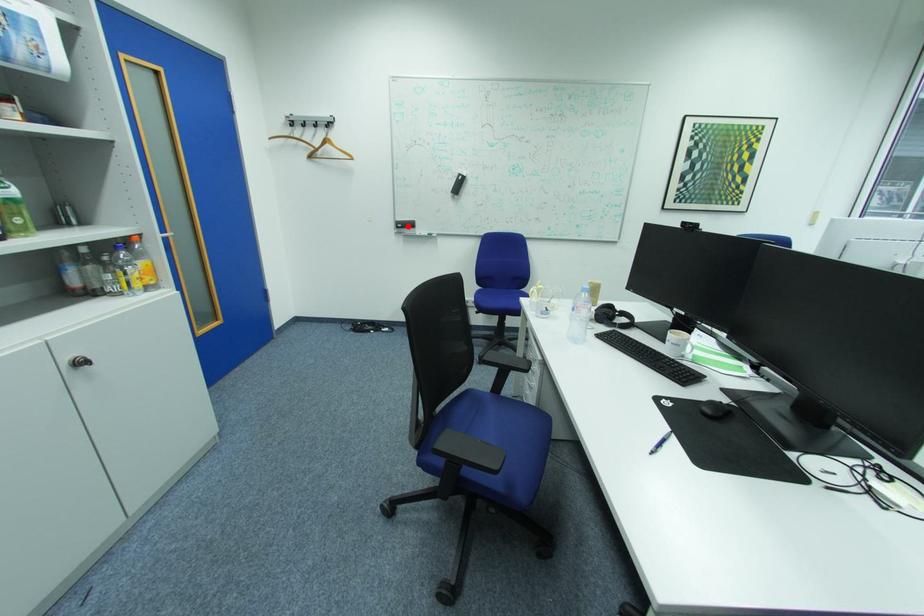
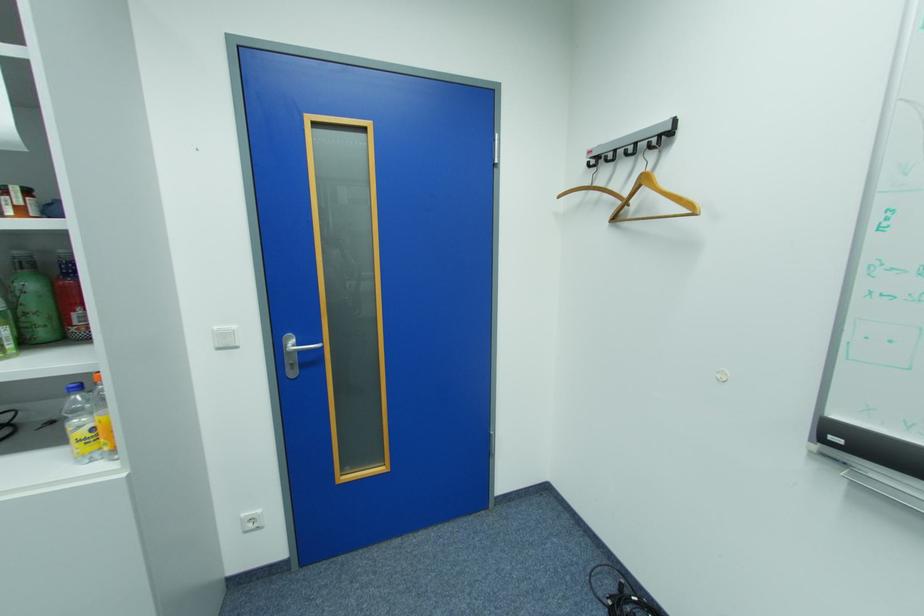
Where in the second image is the point corresponding to the highlighted location from the first image?

(845, 440)